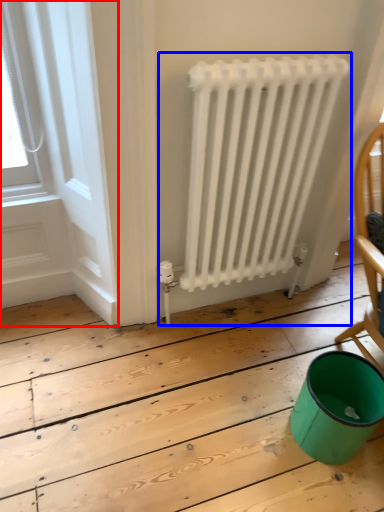
Question: Which of the following is the farthest to the observer, window frame (highlighted by a red box) or radiator (highlighted by a blue box)?

Choices:
 (A) window frame
 (B) radiator

Answer: (B)